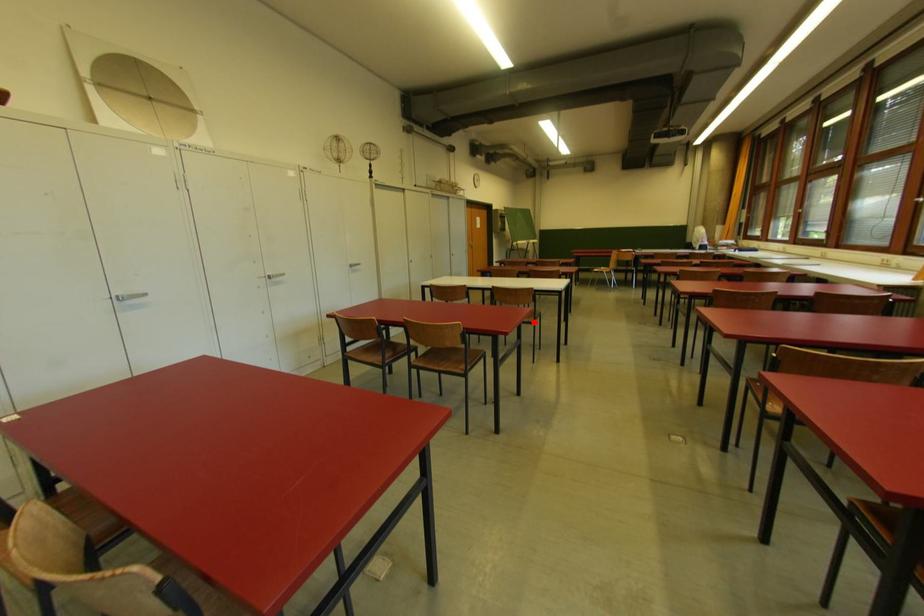
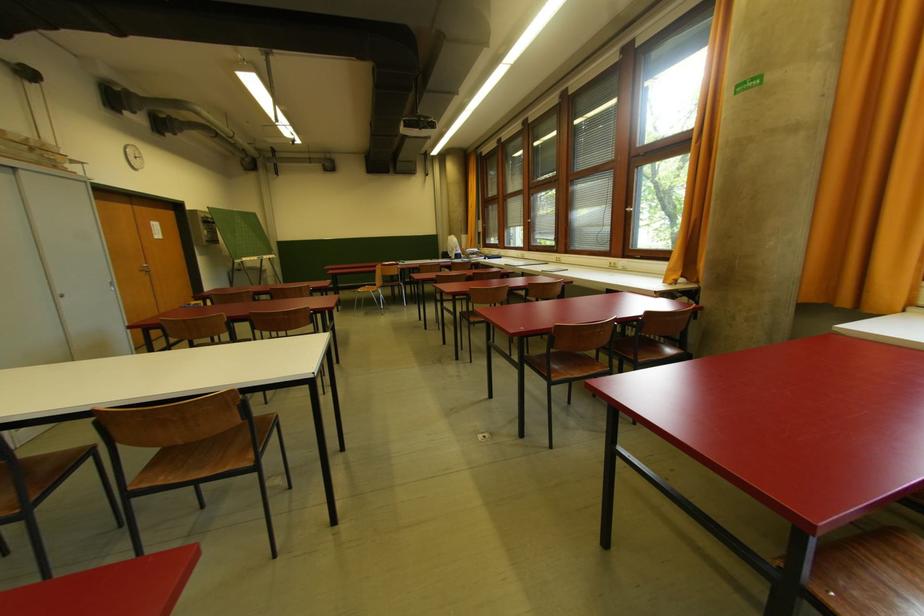
Question: I am providing you with two images of the same scene from different viewpoints. In image1, a red point is highlighted. Considering the same 3D point in image2, which of the following is correct?

Choices:
 (A) It is closer
 (B) It is farther

Answer: (A)